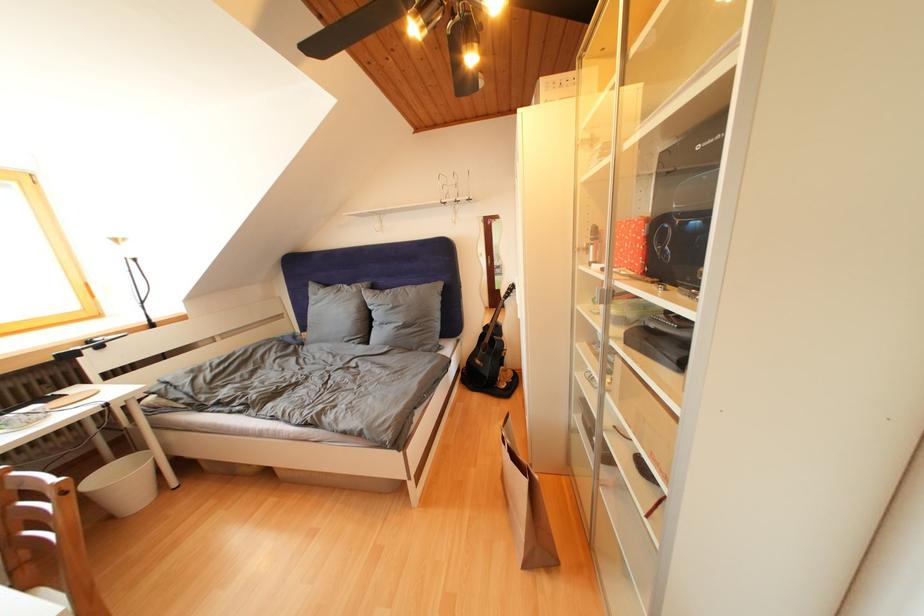
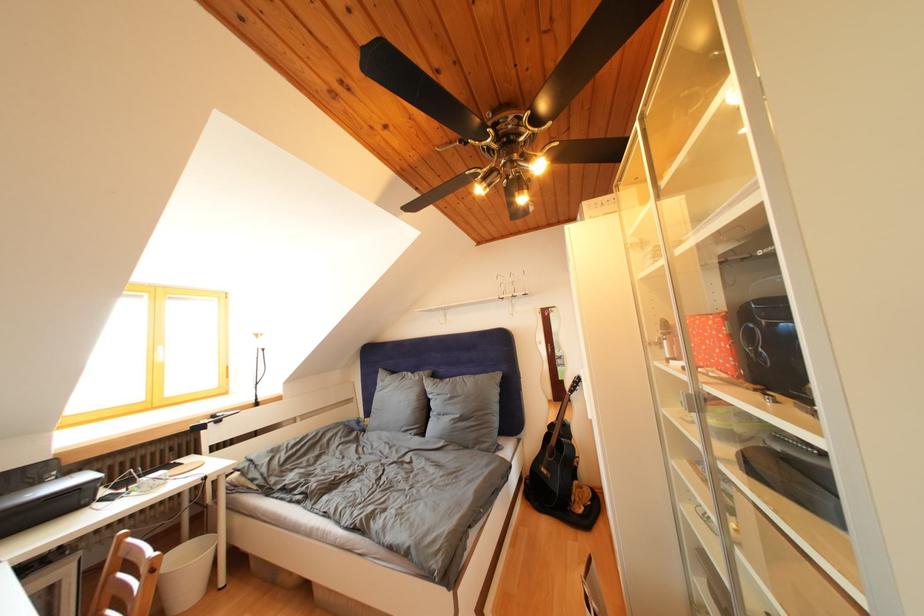
Find the pixel in the second image that matches point (617, 362) in the first image.

(734, 492)